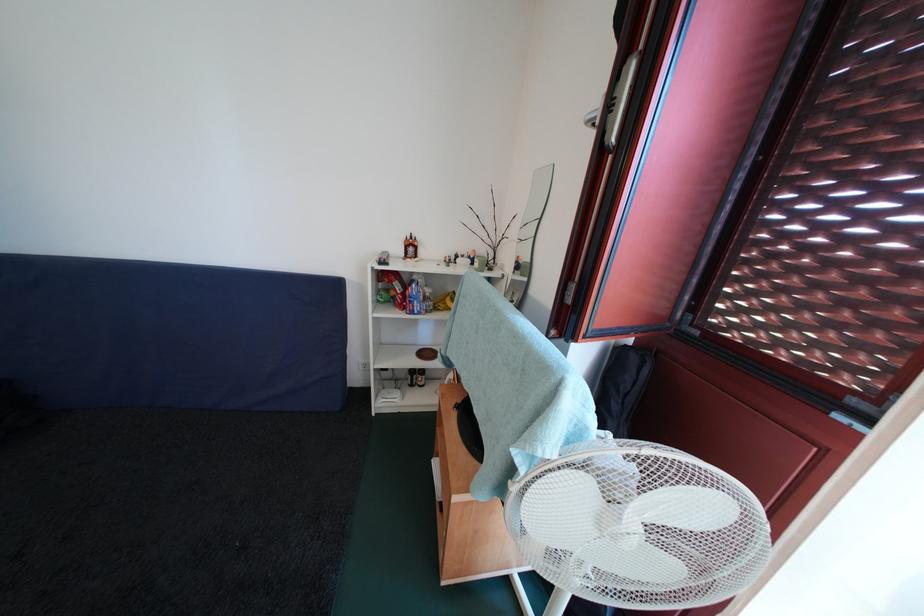
Image resolution: width=924 pixels, height=616 pixels. What do you see at coordinates (176, 485) in the screenshot? I see `the sofa sitting surface` at bounding box center [176, 485].